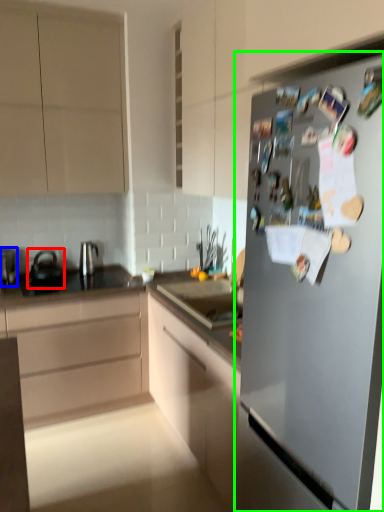
Question: Based on their relative distances, which object is farther from tea pot (highlighted by a red box)? Choose from kitchen appliance (highlighted by a blue box) and refrigerator (highlighted by a green box).

Choices:
 (A) kitchen appliance
 (B) refrigerator

Answer: (B)